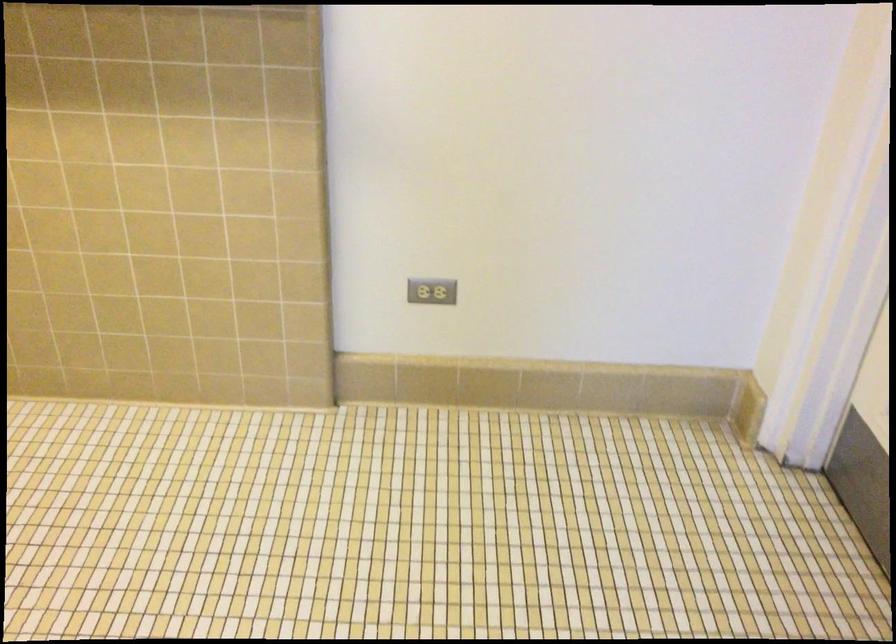
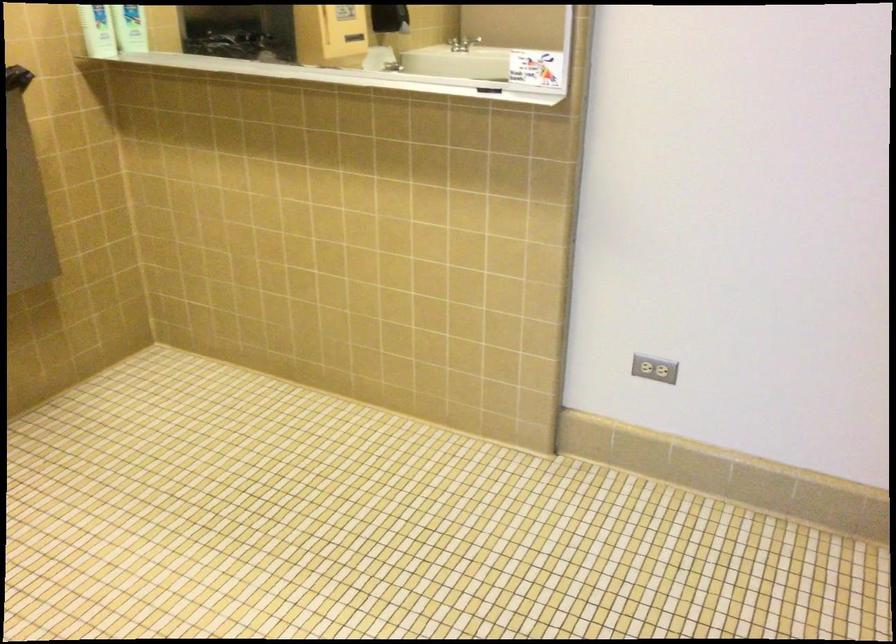
The point at [431,292] is marked in the first image. Where is the corresponding point in the second image?

(655, 368)